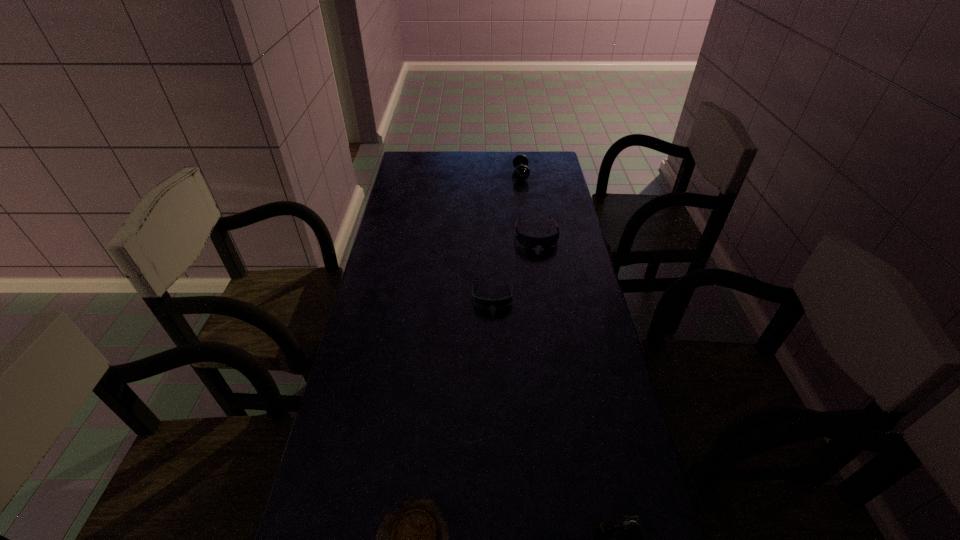
Find the location of a particular element. the tallest object is located at coordinates (521, 172).

Identify the location of the farthest object. This screenshot has height=540, width=960. (521, 172).

I want to click on the second tallest object, so click(530, 242).

What are the coordinates of `the farthest goggles` in the screenshot? It's located at (530, 242).

You are a GUI agent. You are given a task and a screenshot of the screen. Output one action in this format:
    pyautogui.click(x=<x>, y=<y>)
    Task: Click on the leftmost goggles
    
    Given the screenshot: What is the action you would take?
    pyautogui.click(x=484, y=303)

Locate an element on the screen. the second object from left to right is located at coordinates [484, 303].

At what (x,y) coordinates should I click in order to perform the action: click on vacant point located on the back of the farthest object. Please return your answer as a coordinate pair (x, y). Image resolution: width=960 pixels, height=540 pixels. Looking at the image, I should click on (518, 160).

Find the location of a particular element. This screenshot has height=540, width=960. vacant space located on the front and sides of the farthest goggles is located at coordinates (550, 328).

You are a GUI agent. You are given a task and a screenshot of the screen. Output one action in this format:
    pyautogui.click(x=<x>, y=<y>)
    Task: Click on the free location located on the front-facing side of the leftmost goggles
    
    Given the screenshot: What is the action you would take?
    pyautogui.click(x=496, y=421)

Where is `object that is at the far edge`? The height and width of the screenshot is (540, 960). object that is at the far edge is located at coordinates (521, 172).